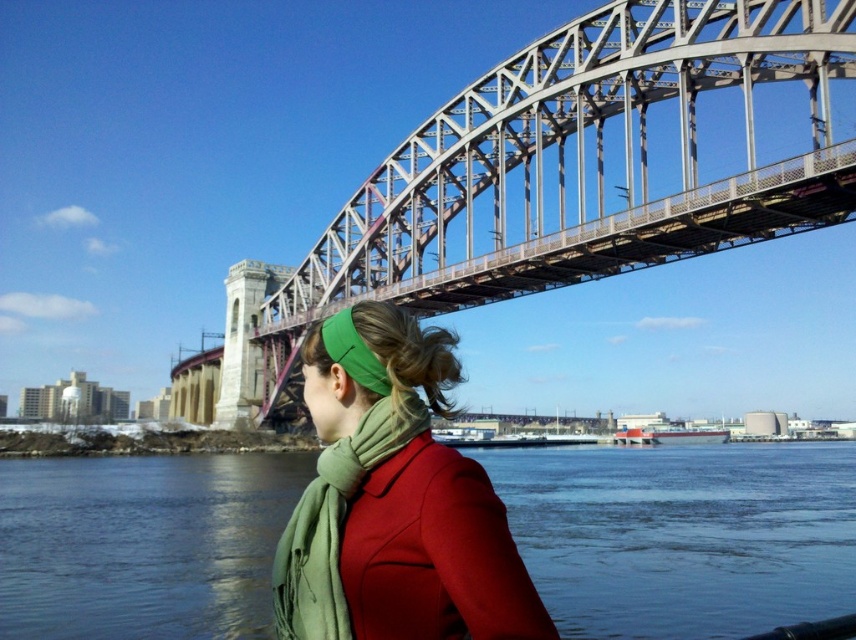
You are a photographer trying to capture the blue water at center and the green soft scarf at center in the same frame. Based on their positions, which object should you adjust your camera to focus on first to ensure both are in the shot?

The blue water at center is positioned on the right side of green soft scarf at center. To capture both in the same frame, focus on the green soft scarf at center first since it is closer to the left, allowing the blue water at center to naturally fall into the right side of the frame.

You are a photographer trying to capture the person in the scene. You want to ensure that both the blue water at center and the green soft scarf at center are visible in your shot. Which object should you adjust your focus to include more of, considering their sizes?

The blue water at center is not as tall as the green soft scarf at center, so you should adjust your focus to include more of the blue water at center since it is smaller and might require a closer look to be adequately captured.